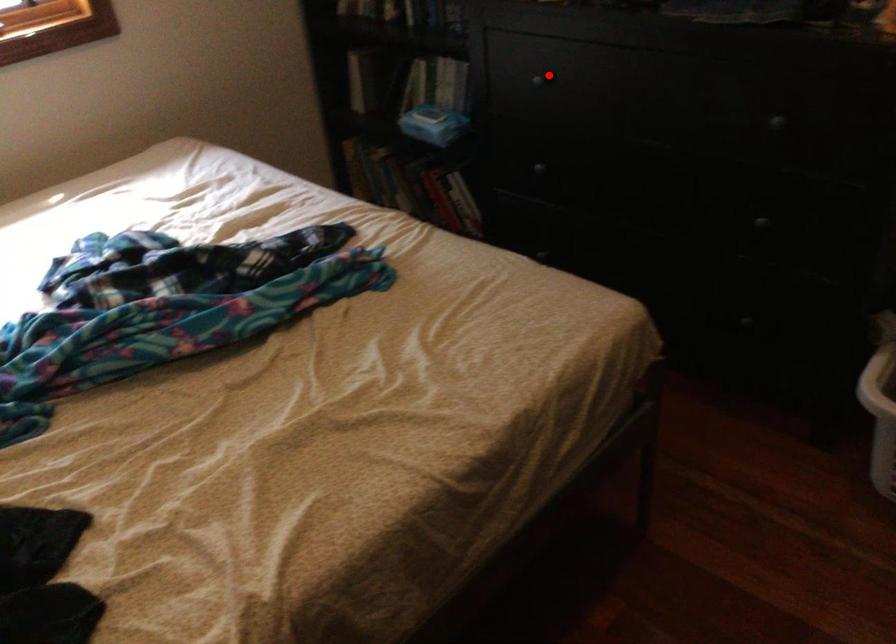
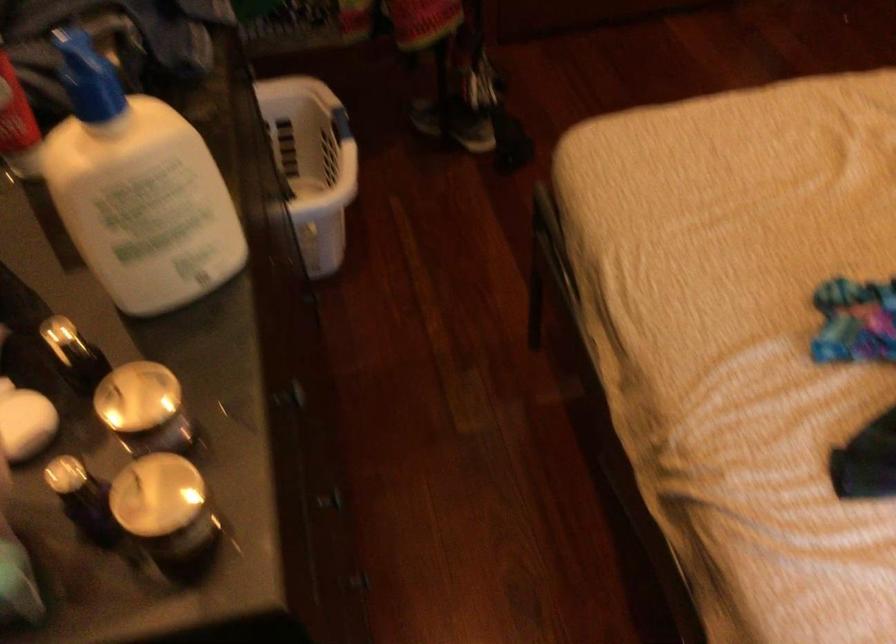
Where in the second image is the point corresponding to the highlighted location from the first image?

(295, 393)